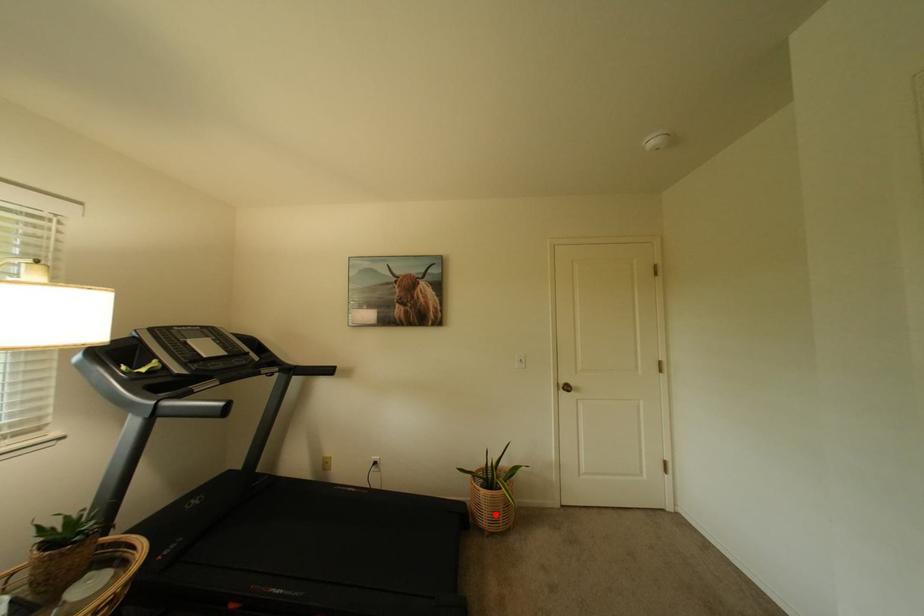
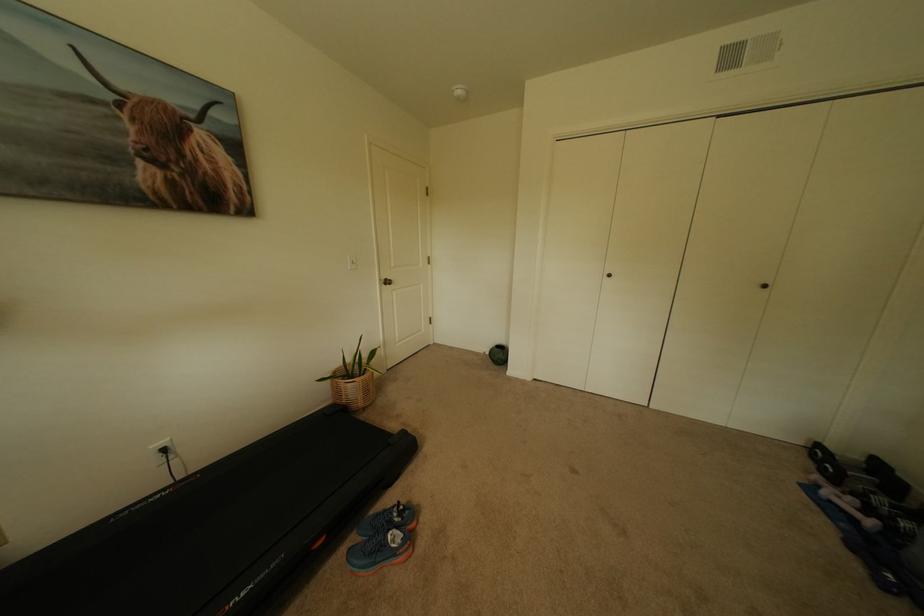
Question: I am providing you with two images of the same scene from different viewpoints. A red point is shown in image1. For the corresponding object point in image2, is it positioned nearer or farther from the camera?

Choices:
 (A) Nearer
 (B) Farther

Answer: (A)